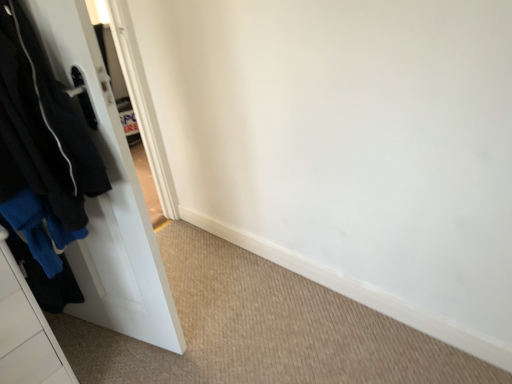
Question: In terms of height, does black matte jacket at left look taller or shorter compared to white matte door at left?

Choices:
 (A) tall
 (B) short

Answer: (B)

Question: Looking at the image, does black matte jacket at left seem bigger or smaller compared to white matte door at left?

Choices:
 (A) big
 (B) small

Answer: (B)

Question: From the image's perspective, relative to white matte door at left, is black matte jacket at left above or below?

Choices:
 (A) below
 (B) above

Answer: (B)

Question: In terms of width, does white matte door at left look wider or thinner when compared to black matte jacket at left?

Choices:
 (A) wide
 (B) thin

Answer: (B)

Question: From a real-world perspective, relative to black matte jacket at left, is white matte door at left vertically above or below?

Choices:
 (A) below
 (B) above

Answer: (A)

Question: Visually, is white matte door at left positioned to the left or to the right of black matte jacket at left?

Choices:
 (A) left
 (B) right

Answer: (B)

Question: Is white matte door at left taller or shorter than black matte jacket at left?

Choices:
 (A) tall
 (B) short

Answer: (A)